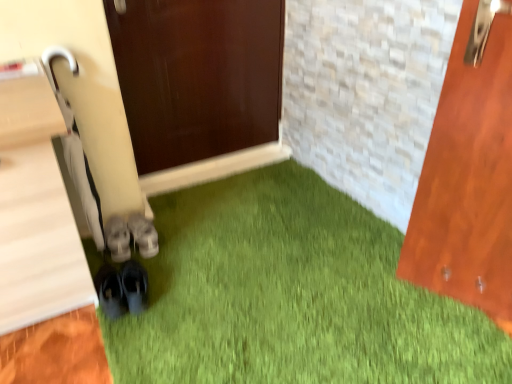
Question: Does gray suede shoes at center, arranged as the third footwear when viewed from the front, have a lesser width compared to black matte shoes at lower left, marked as the third footwear in a back-to-front arrangement?

Choices:
 (A) no
 (B) yes

Answer: (A)

Question: From a real-world perspective, is gray suede shoes at center, arranged as the third footwear when viewed from the front, positioned under black matte shoes at lower left, the first footwear viewed from the front, based on gravity?

Choices:
 (A) yes
 (B) no

Answer: (A)

Question: Is gray suede shoes at center, arranged as the third footwear when viewed from the front, next to black matte shoes at lower left, the first footwear viewed from the front, and touching it?

Choices:
 (A) yes
 (B) no

Answer: (B)

Question: From the image's perspective, is gray suede shoes at center, which appears as the 1th footwear when viewed from the back, beneath black matte shoes at lower left, the first footwear viewed from the front?

Choices:
 (A) yes
 (B) no

Answer: (B)

Question: Is gray suede shoes at center, which appears as the 1th footwear when viewed from the back, bigger than black matte shoes at lower left, the first footwear viewed from the front?

Choices:
 (A) yes
 (B) no

Answer: (B)

Question: Is point (138, 225) positioned closer to the camera than point (118, 243)?

Choices:
 (A) closer
 (B) farther

Answer: (B)

Question: Looking at their shapes, would you say gray suede shoes at center, arranged as the third footwear when viewed from the front, is wider or thinner than white leather sneakers at center, the 2th footwear viewed from the back?

Choices:
 (A) wide
 (B) thin

Answer: (A)

Question: From the image's perspective, is gray suede shoes at center, which appears as the 1th footwear when viewed from the back, above or below white leather sneakers at center, the 2th footwear viewed from the back?

Choices:
 (A) below
 (B) above

Answer: (B)

Question: In terms of size, does gray suede shoes at center, arranged as the third footwear when viewed from the front, appear bigger or smaller than white leather sneakers at center, the 2th footwear from the front?

Choices:
 (A) big
 (B) small

Answer: (A)

Question: In terms of width, does white leather sneakers at center, the 2th footwear from the front, look wider or thinner when compared to gray suede shoes at center, which appears as the 1th footwear when viewed from the back?

Choices:
 (A) wide
 (B) thin

Answer: (B)

Question: Would you say white leather sneakers at center, the 2th footwear from the front, is to the left or to the right of gray suede shoes at center, arranged as the third footwear when viewed from the front, in the picture?

Choices:
 (A) right
 (B) left

Answer: (B)

Question: Considering their positions, is white leather sneakers at center, the 2th footwear from the front, located in front of or behind gray suede shoes at center, arranged as the third footwear when viewed from the front?

Choices:
 (A) front
 (B) behind

Answer: (A)

Question: Based on their sizes in the image, would you say white leather sneakers at center, the 2th footwear viewed from the back, is bigger or smaller than gray suede shoes at center, which appears as the 1th footwear when viewed from the back?

Choices:
 (A) big
 (B) small

Answer: (B)

Question: Considering the relative positions of black matte shoes at lower left, the first footwear viewed from the front, and gray suede shoes at center, which appears as the 1th footwear when viewed from the back, in the image provided, is black matte shoes at lower left, the first footwear viewed from the front, to the left or to the right of gray suede shoes at center, which appears as the 1th footwear when viewed from the back,?

Choices:
 (A) right
 (B) left

Answer: (B)

Question: Considering the positions of black matte shoes at lower left, the first footwear viewed from the front, and gray suede shoes at center, arranged as the third footwear when viewed from the front, in the image, is black matte shoes at lower left, the first footwear viewed from the front, taller or shorter than gray suede shoes at center, arranged as the third footwear when viewed from the front,?

Choices:
 (A) tall
 (B) short

Answer: (A)